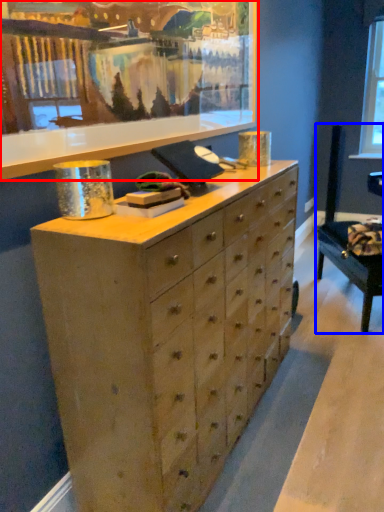
Question: Which object appears farthest to the camera in this image, picture frame (highlighted by a red box) or swivel chair (highlighted by a blue box)?

Choices:
 (A) picture frame
 (B) swivel chair

Answer: (B)